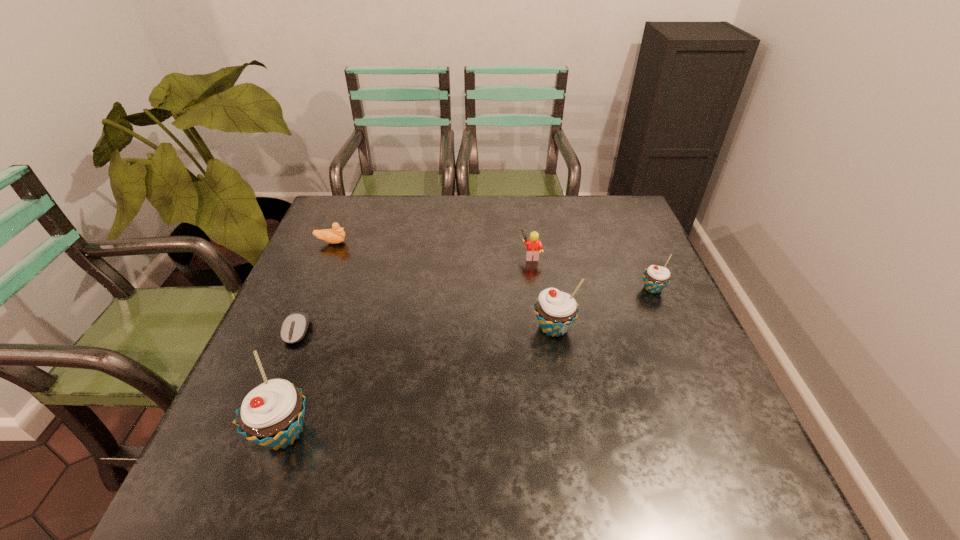
Identify which object is the second closest to the second farthest object. Please provide its 2D coordinates. Your answer should be formatted as a tuple, i.e. [(x, y)], where the tuple contains the x and y coordinates of a point satisfying the conditions above.

[(656, 278)]

Locate an element on the screen. The width and height of the screenshot is (960, 540). the closest cupcake to the rightmost cupcake is located at coordinates (556, 311).

Select which cupcake is the closest to the shortest object. Please provide its 2D coordinates. Your answer should be formatted as a tuple, i.e. [(x, y)], where the tuple contains the x and y coordinates of a point satisfying the conditions above.

[(271, 415)]

I want to click on free location that satisfies the following two spatial constraints: 1. in front of the Lego with the accessory visible; 2. on the left side of the second cupcake from right to left, so click(541, 327).

Find the location of a particular element. free spot that satisfies the following two spatial constraints: 1. on the face of the fifth tallest object; 2. on the left side of the nearest object is located at coordinates pos(252,433).

Locate an element on the screen. blank space that satisfies the following two spatial constraints: 1. in front of the Lego with the accessory visible; 2. on the front side of the leftmost cupcake is located at coordinates (556, 433).

Where is `free space that satisfies the following two spatial constraints: 1. on the back side of the rightmost object; 2. on the face of the duckling`? free space that satisfies the following two spatial constraints: 1. on the back side of the rightmost object; 2. on the face of the duckling is located at coordinates (633, 242).

At what (x,y) coordinates should I click in order to perform the action: click on vacant space that satisfies the following two spatial constraints: 1. on the face of the farthest cupcake; 2. on the left side of the farthest object. Please return your answer as a coordinate pair (x, y). The width and height of the screenshot is (960, 540). Looking at the image, I should click on (312, 289).

Image resolution: width=960 pixels, height=540 pixels. Find the location of `free point that satisfies the following two spatial constraints: 1. on the face of the duckling; 2. on the left side of the rightmost cupcake`. free point that satisfies the following two spatial constraints: 1. on the face of the duckling; 2. on the left side of the rightmost cupcake is located at coordinates coord(312,289).

This screenshot has width=960, height=540. Identify the location of vacant region that satisfies the following two spatial constraints: 1. on the back side of the shortest cupcake; 2. on the left side of the nearest cupcake. (335, 289).